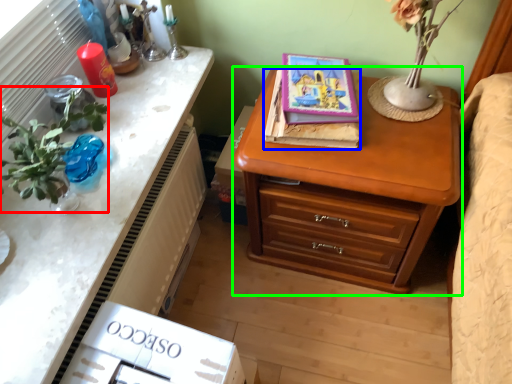
Question: Which object is the farthest from floral arrangement (highlighted by a red box)? Choose among these: book (highlighted by a blue box) or chest of drawers (highlighted by a green box).

Choices:
 (A) book
 (B) chest of drawers

Answer: (B)